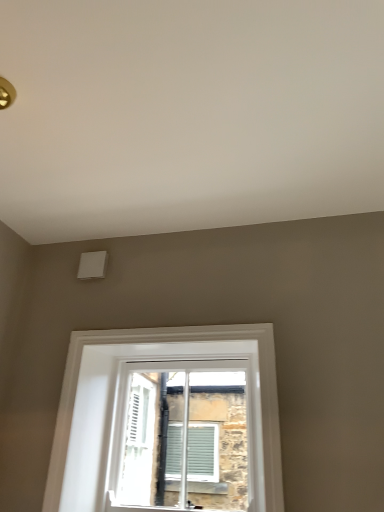
Question: Is white plastic window at center, which ranks as the 2th window in back-to-front order, to the right of white glass window at center, which is the 1th window in back-to-front order, from the viewer's perspective?

Choices:
 (A) yes
 (B) no

Answer: (B)

Question: Is white plastic window at center, positioned as the 1th window in front-to-back order, completely or partially outside of white glass window at center, the 2th window from the front?

Choices:
 (A) yes
 (B) no

Answer: (A)

Question: From a real-world perspective, is white plastic window at center, which ranks as the 2th window in back-to-front order, positioned under white glass window at center, which is the 1th window in back-to-front order, based on gravity?

Choices:
 (A) yes
 (B) no

Answer: (B)

Question: Is white plastic window at center, which ranks as the 2th window in back-to-front order, thinner than white glass window at center, the 2th window from the front?

Choices:
 (A) yes
 (B) no

Answer: (A)

Question: Is white plastic window at center, positioned as the 1th window in front-to-back order, behind white glass window at center, which is the 1th window in back-to-front order?

Choices:
 (A) no
 (B) yes

Answer: (A)

Question: Is white plastic window at center, positioned as the 1th window in front-to-back order, positioned before white glass window at center, which is the 1th window in back-to-front order?

Choices:
 (A) yes
 (B) no

Answer: (A)

Question: From the image's perspective, would you say white glass window at center, which is the 1th window in back-to-front order, is positioned over white plastic window at center, which ranks as the 2th window in back-to-front order?

Choices:
 (A) no
 (B) yes

Answer: (A)

Question: Can you see white glass window at center, which is the 1th window in back-to-front order, touching white plastic window at center, which ranks as the 2th window in back-to-front order?

Choices:
 (A) no
 (B) yes

Answer: (A)

Question: Can you confirm if white glass window at center, the 2th window from the front, is smaller than white plastic window at center, positioned as the 1th window in front-to-back order?

Choices:
 (A) no
 (B) yes

Answer: (A)

Question: Is white glass window at center, the 2th window from the front, oriented away from white plastic window at center, positioned as the 1th window in front-to-back order?

Choices:
 (A) no
 (B) yes

Answer: (B)

Question: Is white glass window at center, which is the 1th window in back-to-front order, far from white plastic window at center, positioned as the 1th window in front-to-back order?

Choices:
 (A) no
 (B) yes

Answer: (A)

Question: Does white glass window at center, the 2th window from the front, have a greater width compared to white plastic window at center, positioned as the 1th window in front-to-back order?

Choices:
 (A) yes
 (B) no

Answer: (A)

Question: Looking at their shapes, would you say white plastic window at center, which ranks as the 2th window in back-to-front order, is wider or thinner than white glass window at center, the 2th window from the front?

Choices:
 (A) wide
 (B) thin

Answer: (B)